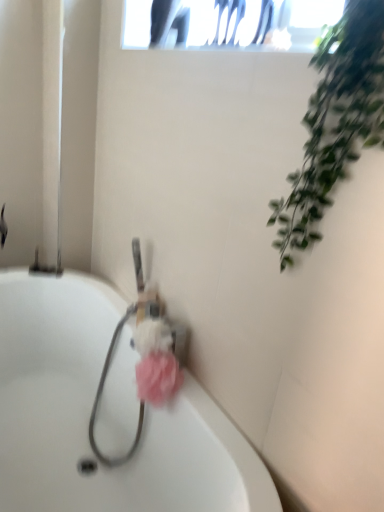
Question: From a real-world perspective, is pink fluffy sponge at center positioned under white glossy bathtub at center based on gravity?

Choices:
 (A) no
 (B) yes

Answer: (A)

Question: Is white glossy bathtub at center completely or partially inside pink fluffy sponge at center?

Choices:
 (A) no
 (B) yes

Answer: (A)

Question: From a real-world perspective, is pink fluffy sponge at center physically above white glossy bathtub at center?

Choices:
 (A) no
 (B) yes

Answer: (B)

Question: Is pink fluffy sponge at center positioned in front of white glossy bathtub at center?

Choices:
 (A) yes
 (B) no

Answer: (B)

Question: Can you confirm if pink fluffy sponge at center is wider than white glossy bathtub at center?

Choices:
 (A) no
 (B) yes

Answer: (A)

Question: Is pink fluffy sponge at center outside of white glossy bathtub at center?

Choices:
 (A) no
 (B) yes

Answer: (A)

Question: From the image's perspective, is white glossy bathtub at center located above green leafy plant at upper right?

Choices:
 (A) no
 (B) yes

Answer: (A)

Question: Can you confirm if white glossy bathtub at center is thinner than green leafy plant at upper right?

Choices:
 (A) yes
 (B) no

Answer: (B)

Question: Is white glossy bathtub at center with green leafy plant at upper right?

Choices:
 (A) no
 (B) yes

Answer: (A)

Question: Could you tell me if white glossy bathtub at center is facing green leafy plant at upper right?

Choices:
 (A) no
 (B) yes

Answer: (A)

Question: Does white glossy bathtub at center come behind green leafy plant at upper right?

Choices:
 (A) no
 (B) yes

Answer: (B)

Question: Considering the relative sizes of white glossy bathtub at center and green leafy plant at upper right in the image provided, is white glossy bathtub at center taller than green leafy plant at upper right?

Choices:
 (A) no
 (B) yes

Answer: (B)

Question: From the image's perspective, is pink fluffy sponge at center, the second flower positioned from the top, beneath pink fluffy loofah at center, acting as the second flower starting from the bottom?

Choices:
 (A) yes
 (B) no

Answer: (A)